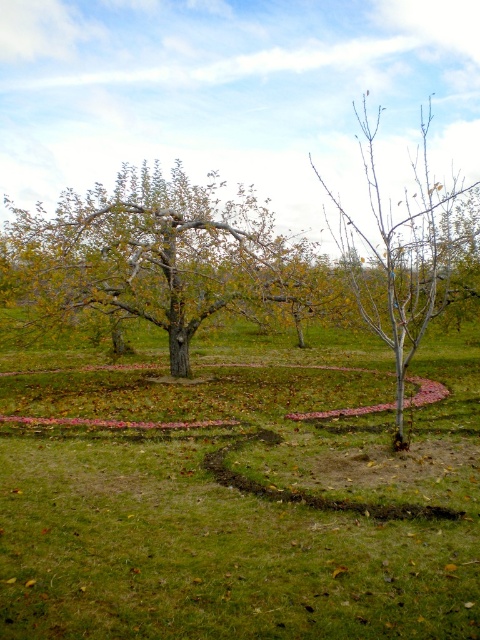
Question: Which point is farther to the camera?

Choices:
 (A) bare branches at center
 (B) green leafy tree at center

Answer: (B)

Question: Which of the following is the farthest from the observer?

Choices:
 (A) (194, 269)
 (B) (361, 580)

Answer: (A)

Question: From the image, what is the correct spatial relationship of green leafy tree at center in relation to bare branches at center?

Choices:
 (A) left
 (B) right

Answer: (A)

Question: Is the position of green leafy tree at center less distant than that of bare branches at center?

Choices:
 (A) yes
 (B) no

Answer: (B)

Question: Does green leafy tree at center appear over bare branches at center?

Choices:
 (A) no
 (B) yes

Answer: (B)

Question: Which point appears farthest from the camera in this image?

Choices:
 (A) (85, 298)
 (B) (163, 406)

Answer: (A)